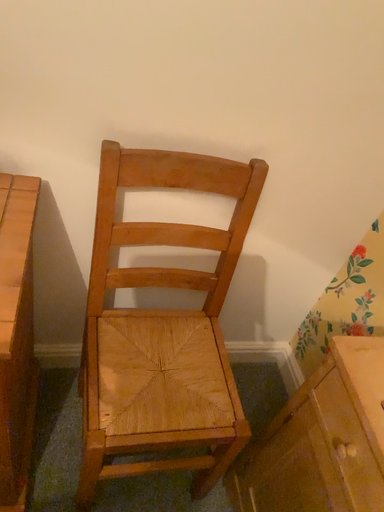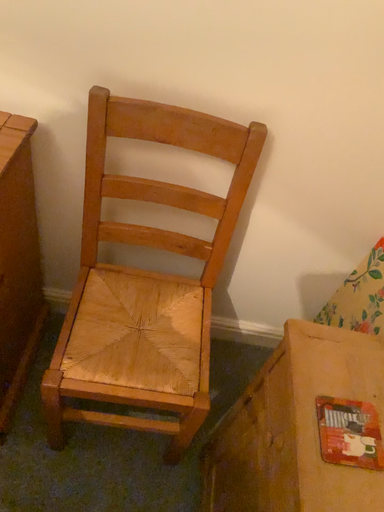
Question: Which way did the camera rotate in the video?

Choices:
 (A) rotated left
 (B) rotated right

Answer: (A)